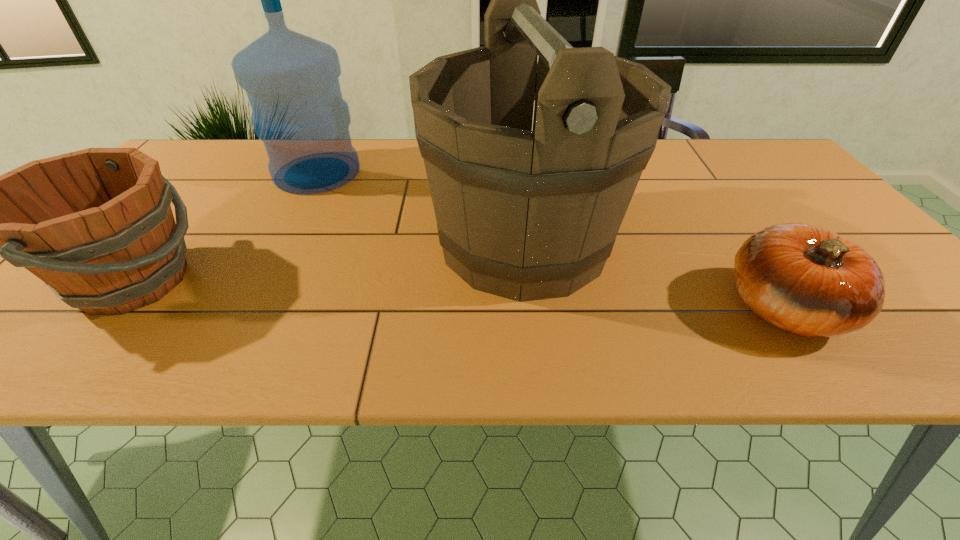
This screenshot has height=540, width=960. In the image, there is a desktop. In order to click on vacant space at the far left corner in this screenshot , I will do `click(239, 150)`.

Find the location of `free space between the leftmost object and the pumpkin`. free space between the leftmost object and the pumpkin is located at coordinates (459, 294).

The width and height of the screenshot is (960, 540). What are the coordinates of `unoccupied position between the left bucket and the third object from left to right` in the screenshot? It's located at (329, 261).

Identify the location of free space between the pumpkin and the left bucket. Image resolution: width=960 pixels, height=540 pixels. (459, 294).

In order to click on free spot between the second object from left to right and the leftmost object in this screenshot , I will do `click(226, 227)`.

Find the location of a particular element. Image resolution: width=960 pixels, height=540 pixels. vacant space in between the pumpkin and the right bucket is located at coordinates (654, 275).

Where is `free area in between the water jug and the third object from left to right`? This screenshot has width=960, height=540. free area in between the water jug and the third object from left to right is located at coordinates (420, 207).

The image size is (960, 540). What are the coordinates of `blank region between the water jug and the right bucket` in the screenshot? It's located at (420, 207).

Locate an element on the screen. vacant area that lies between the second object from right to left and the shortest object is located at coordinates (654, 275).

Find the location of `unoccupied position between the left bucket and the taller bucket`. unoccupied position between the left bucket and the taller bucket is located at coordinates (329, 261).